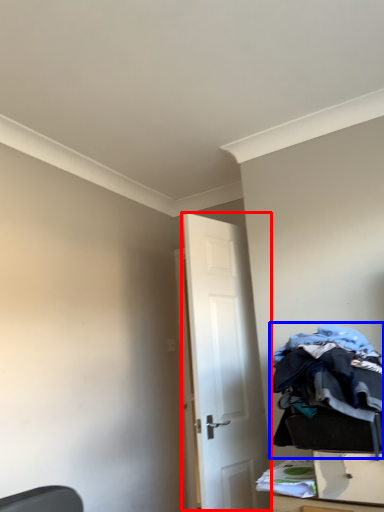
Question: Which object is closer to the camera taking this photo, door (highlighted by a red box) or laundry (highlighted by a blue box)?

Choices:
 (A) door
 (B) laundry

Answer: (B)